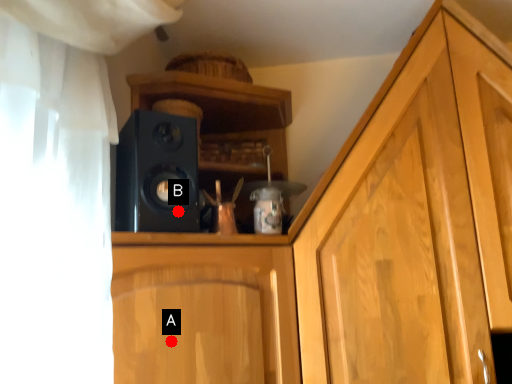
Question: Two points are circled on the image, labeled by A and B beside each circle. Among these points, which one is nearest to the camera?

Choices:
 (A) A is closer
 (B) B is closer

Answer: (A)